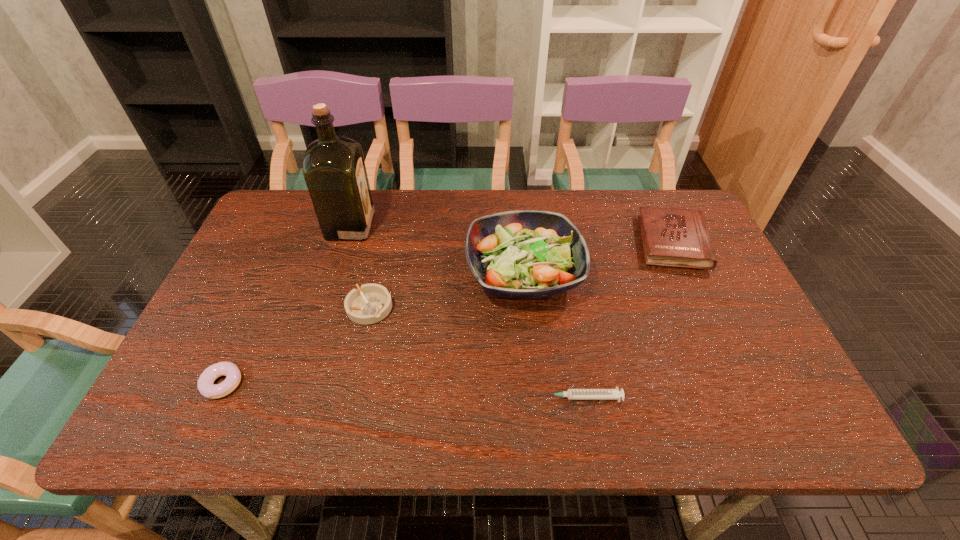
Where is `free space that satisfies the following two spatial constraints: 1. on the label of the liquor; 2. on the left side of the rightmost object`? The image size is (960, 540). free space that satisfies the following two spatial constraints: 1. on the label of the liquor; 2. on the left side of the rightmost object is located at coordinates (346, 243).

The height and width of the screenshot is (540, 960). Identify the location of free space in the image that satisfies the following two spatial constraints: 1. on the back side of the salad plate; 2. on the right side of the rightmost object. (520, 243).

Locate an element on the screen. Image resolution: width=960 pixels, height=540 pixels. free space that satisfies the following two spatial constraints: 1. on the label of the fifth shortest object; 2. on the left side of the liquor is located at coordinates (336, 273).